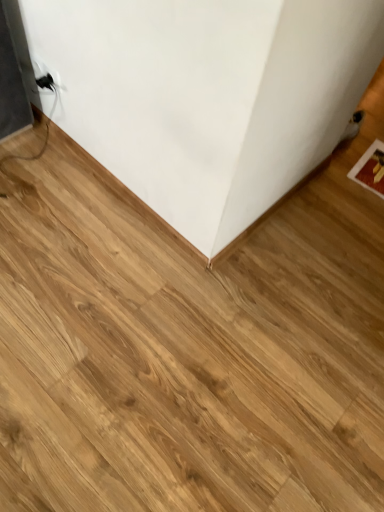
Question: From a real-world perspective, is black plastic electric outlet at upper left positioned above or below wooden floor at center?

Choices:
 (A) above
 (B) below

Answer: (A)

Question: Choose the correct answer: Is black plastic electric outlet at upper left inside wooden floor at center or outside it?

Choices:
 (A) inside
 (B) outside

Answer: (B)

Question: Considering the positions of black plastic electric outlet at upper left and wooden floor at center in the image, is black plastic electric outlet at upper left wider or thinner than wooden floor at center?

Choices:
 (A) thin
 (B) wide

Answer: (A)

Question: From the image's perspective, is wooden floor at center located above or below black plastic electric outlet at upper left?

Choices:
 (A) above
 (B) below

Answer: (B)

Question: Considering the positions of wooden floor at center and black plastic electric outlet at upper left in the image, is wooden floor at center wider or thinner than black plastic electric outlet at upper left?

Choices:
 (A) thin
 (B) wide

Answer: (B)

Question: Would you say wooden floor at center is to the left or to the right of black plastic electric outlet at upper left in the picture?

Choices:
 (A) right
 (B) left

Answer: (A)

Question: Is point (264, 45) closer or farther from the camera than point (33, 59)?

Choices:
 (A) closer
 (B) farther

Answer: (A)